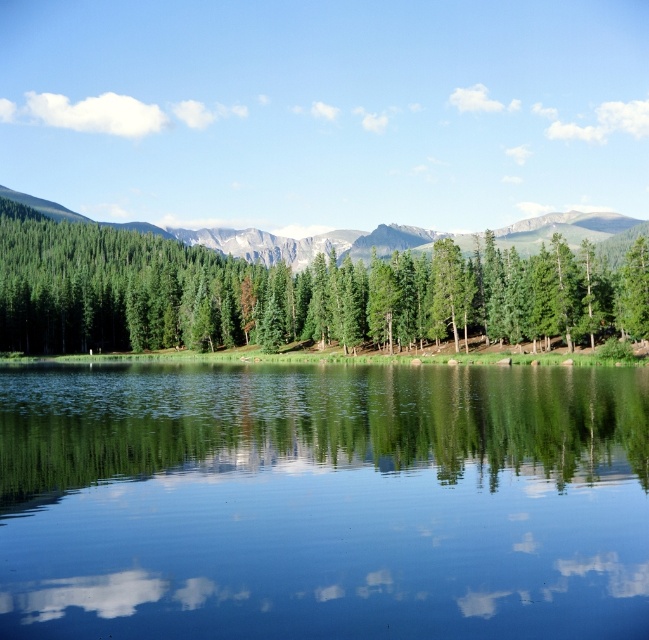
You are standing at the edge of the lake and see the green glossy water at center and the green matte tree at center. Which object is nearer to you?

The green glossy water at center is closer to the viewer than the green matte tree at center.

You are an artist planning to paint the landscape. You want to ensure the green glossy water at center and the green matte tree at center are proportionate. Which object should you make taller in your painting?

The green glossy water at center is not as tall as the green matte tree at center, so you should make the green matte tree at center taller than the green glossy water at center in your painting.

You are standing at the point marked as point [288,292] in the image. What object is located exactly at that coordinate?

The green matte tree at center is located exactly at point [288,292].